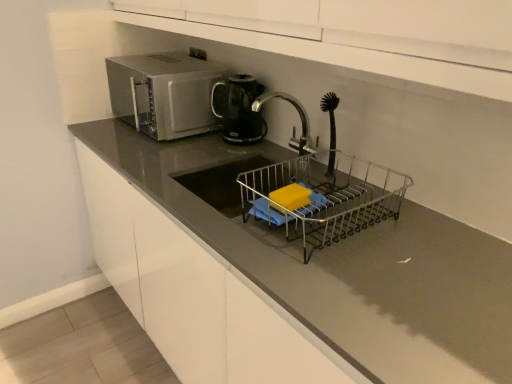
What is the approximate width of black plastic kettle at upper center?

black plastic kettle at upper center is 7.03 inches wide.

At what (x,y) coordinates should I click in order to perform the action: click on yellow sponge at sink. Please return your answer as a coordinate pair (x, y). This screenshot has height=384, width=512. Looking at the image, I should click on (290, 198).

This screenshot has height=384, width=512. What do you see at coordinates (324, 197) in the screenshot?
I see `metallic wire dish rack at center` at bounding box center [324, 197].

What do you see at coordinates (196, 294) in the screenshot? Image resolution: width=512 pixels, height=384 pixels. I see `matte gray countertop at center` at bounding box center [196, 294].

The height and width of the screenshot is (384, 512). Identify the location of satin silver microwave at upper left. (164, 93).

What do you see at coordinates (164, 93) in the screenshot? This screenshot has height=384, width=512. I see `satin silver microwave at upper left` at bounding box center [164, 93].

At what (x,y) coordinates should I click in order to perform the action: click on black plastic kettle at upper center. Please return your answer as a coordinate pair (x, y). This screenshot has height=384, width=512. Looking at the image, I should click on (239, 109).

Is yellow sponge at sink located outside black plastic kettle at upper center?

yellow sponge at sink is positioned outside black plastic kettle at upper center.

From their relative heights in the image, would you say yellow sponge at sink is taller or shorter than black plastic kettle at upper center?

yellow sponge at sink is shorter than black plastic kettle at upper center.

Between yellow sponge at sink and black plastic kettle at upper center, which one is positioned behind?

black plastic kettle at upper center is more distant.

Which point is more distant from viewer, (294, 208) or (218, 83)?

Positioned behind is point (218, 83).

Can you tell me how much silver metallic tap at center and matte gray countertop at center differ in facing direction?

The angle between the facing direction of silver metallic tap at center and the facing direction of matte gray countertop at center is 0.00373 degrees.

Can you confirm if silver metallic tap at center is shorter than matte gray countertop at center?

Yes.

Who is bigger, silver metallic tap at center or matte gray countertop at center?

With larger size is matte gray countertop at center.

Does silver metallic tap at center turn towards matte gray countertop at center?

No, silver metallic tap at center is not oriented towards matte gray countertop at center.

Does point (290, 102) appear closer or farther from the camera than point (209, 77)?

Point (290, 102) appears to be closer to the viewer than point (209, 77).

Based on their sizes in the image, would you say silver metallic tap at center is bigger or smaller than satin silver microwave at upper left?

silver metallic tap at center is smaller than satin silver microwave at upper left.

At what (x,y) coordinates should I click in order to perform the action: click on tap in front of the satin silver microwave at upper left. Please return your answer as a coordinate pair (x, y). Looking at the image, I should click on (298, 116).

Is silver metallic tap at center to the right of satin silver microwave at upper left from the viewer's perspective?

Yes.

Does matte gray countertop at center appear on the right side of silver metallic tap at center?

Incorrect, matte gray countertop at center is not on the right side of silver metallic tap at center.

Is point (257, 292) closer or farther from the camera than point (297, 144)?

Point (257, 292) is positioned closer to the camera compared to point (297, 144).

Between matte gray countertop at center and silver metallic tap at center, which one has smaller width?

silver metallic tap at center.

From a real-world perspective, is matte gray countertop at center positioned over satin silver microwave at upper left based on gravity?

No.

Is matte gray countertop at center not near satin silver microwave at upper left?

Actually, matte gray countertop at center and satin silver microwave at upper left are a little close together.

From the image's perspective, is matte gray countertop at center under satin silver microwave at upper left?

Yes.

Considering the relative sizes of matte gray countertop at center and satin silver microwave at upper left in the image provided, is matte gray countertop at center wider than satin silver microwave at upper left?

Yes, matte gray countertop at center is wider than satin silver microwave at upper left.

How different are the orientations of satin silver microwave at upper left and yellow sponge at sink in degrees?

There is a 3.7-degree angle between the facing directions of satin silver microwave at upper left and yellow sponge at sink.

From the image's perspective, is satin silver microwave at upper left located above or below yellow sponge at sink?

Clearly, from the image's perspective, satin silver microwave at upper left is above yellow sponge at sink.

Would you say satin silver microwave at upper left is a long distance from yellow sponge at sink?

No.

Which is more to the right, silver metallic tap at center or black plastic kettle at upper center?

silver metallic tap at center is more to the right.

Which of these two, silver metallic tap at center or black plastic kettle at upper center, is bigger?

Bigger between the two is silver metallic tap at center.

Based on the photo, is silver metallic tap at center turned away from black plastic kettle at upper center?

No, silver metallic tap at center is not facing away from black plastic kettle at upper center.

Is black plastic kettle at upper center located within silver metallic tap at center?

No, black plastic kettle at upper center is not surrounded by silver metallic tap at center.

Identify the location of kitchen appliance above the yellow sponge at sink (from a real-world perspective). (239, 109).

You are a GUI agent. You are given a task and a screenshot of the screen. Output one action in this format:
    pyautogui.click(x=<x>, y=<y>)
    Task: Click on the cabinetry below the silver metallic tap at center (from a real-world perspective)
    Image resolution: width=512 pixels, height=384 pixels.
    Given the screenshot: What is the action you would take?
    pyautogui.click(x=196, y=294)

Based on the photo, estimate the real-world distances between objects in this image. Which object is closer to matte gray countertop at center, silver metallic tap at center or black plastic kettle at upper center?

black plastic kettle at upper center is closer to matte gray countertop at center.

From the image, which object appears to be farther from yellow sponge at sink, metallic wire dish rack at center or black plastic kettle at upper center?

The object further to yellow sponge at sink is black plastic kettle at upper center.

When comparing their distances from metallic wire dish rack at center, does matte gray countertop at center or yellow sponge at sink seem closer?

yellow sponge at sink is closer to metallic wire dish rack at center.

When comparing their distances from metallic wire dish rack at center, does silver metallic tap at center or black plastic kettle at upper center seem closer?

Among the two, silver metallic tap at center is located nearer to metallic wire dish rack at center.

Based on their spatial positions, is satin silver microwave at upper left or matte gray countertop at center closer to black plastic kettle at upper center?

The object closer to black plastic kettle at upper center is satin silver microwave at upper left.

Which object lies further to the anchor point yellow sponge at sink, matte gray countertop at center or satin silver microwave at upper left?

satin silver microwave at upper left lies further to yellow sponge at sink than the other object.

Considering their positions, is matte gray countertop at center positioned further to yellow sponge at sink than silver metallic tap at center?

matte gray countertop at center is further to yellow sponge at sink.

Considering their positions, is matte gray countertop at center positioned further to metallic wire dish rack at center than black plastic kettle at upper center?

The object further to metallic wire dish rack at center is matte gray countertop at center.

The width and height of the screenshot is (512, 384). Find the location of `home appliance between metallic wire dish rack at center and black plastic kettle at upper center from front to back`. home appliance between metallic wire dish rack at center and black plastic kettle at upper center from front to back is located at coordinates (164, 93).

I want to click on tap between yellow sponge at sink and black plastic kettle at upper center from front to back, so click(298, 116).

In order to click on kitchen appliance between satin silver microwave at upper left and silver metallic tap at center from left to right in this screenshot , I will do `click(239, 109)`.

Locate an element on the screen. tap between matte gray countertop at center and black plastic kettle at upper center in the front-back direction is located at coordinates click(x=298, y=116).